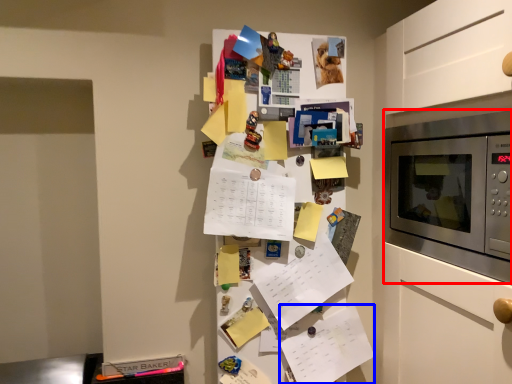
Question: Among these objects, which one is nearest to the camera, microwave oven (highlighted by a red box) or list (highlighted by a blue box)?

Choices:
 (A) microwave oven
 (B) list

Answer: (A)